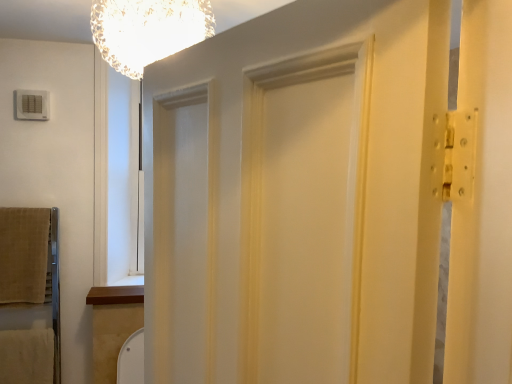
Question: From the image's perspective, is beige soft towel at left above or below translucent glass chandelier at upper center?

Choices:
 (A) below
 (B) above

Answer: (A)

Question: Relative to translucent glass chandelier at upper center, is beige soft towel at left in front or behind?

Choices:
 (A) behind
 (B) front

Answer: (A)

Question: Considering the real-world distances, which object is farthest from the beige soft towel at left?

Choices:
 (A) white painted wood barn door at center
 (B) translucent glass chandelier at upper center

Answer: (A)

Question: Which is nearer to the translucent glass chandelier at upper center?

Choices:
 (A) white painted wood barn door at center
 (B) beige soft towel at left

Answer: (A)